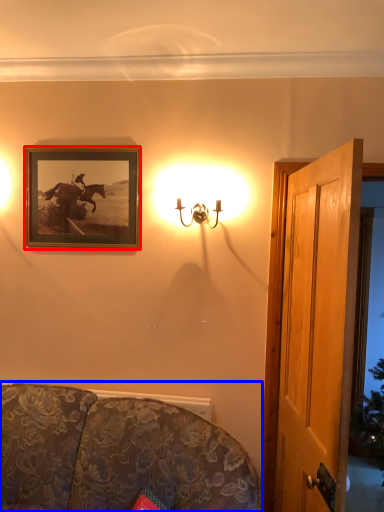
Question: Among these objects, which one is farthest to the camera, picture frame (highlighted by a red box) or studio couch (highlighted by a blue box)?

Choices:
 (A) picture frame
 (B) studio couch

Answer: (A)